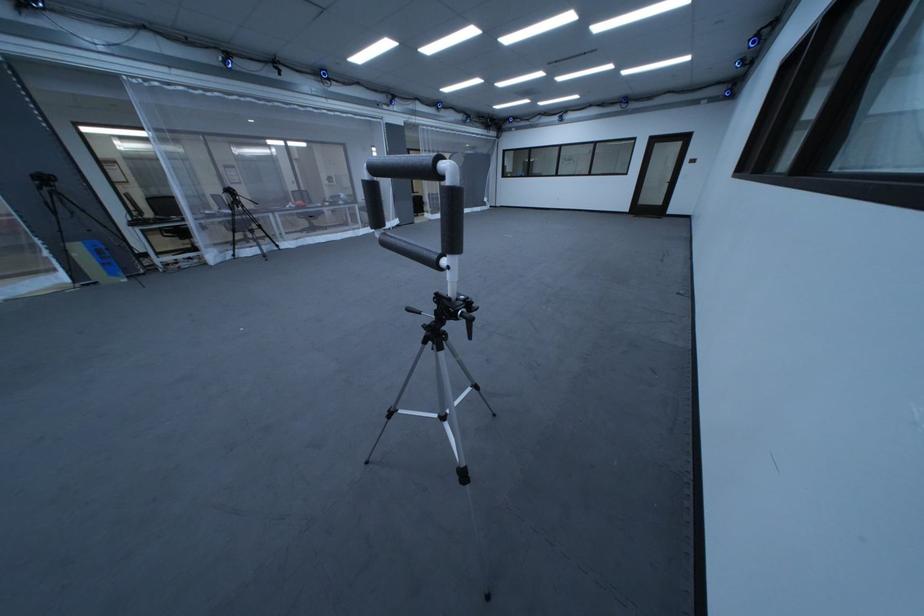
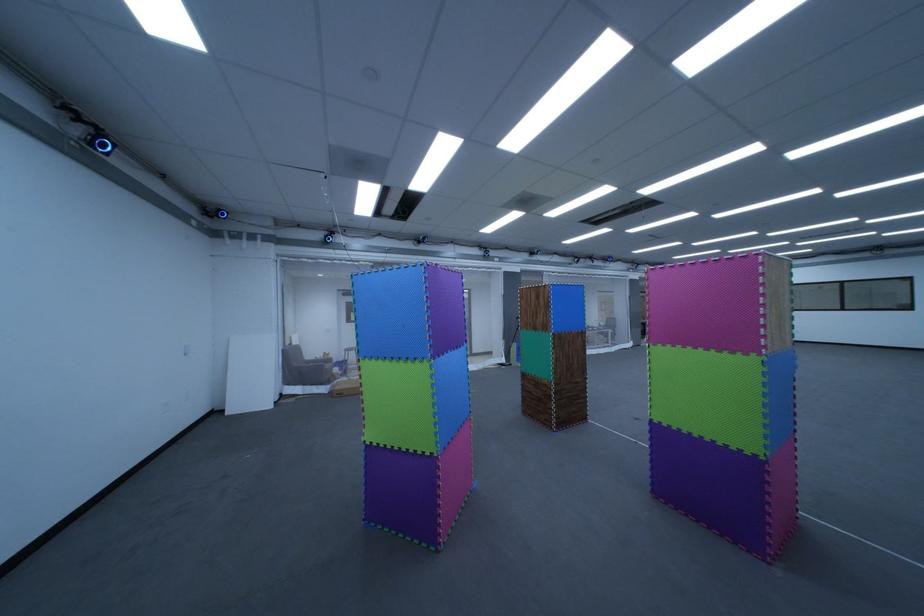
Locate, in the second image, the point that corresponds to point (429, 224) in the first image.

(655, 346)